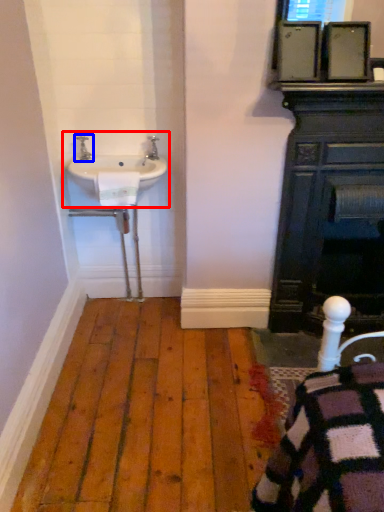
Question: Which object is closer to the camera taking this photo, sink (highlighted by a red box) or tap (highlighted by a blue box)?

Choices:
 (A) sink
 (B) tap

Answer: (A)